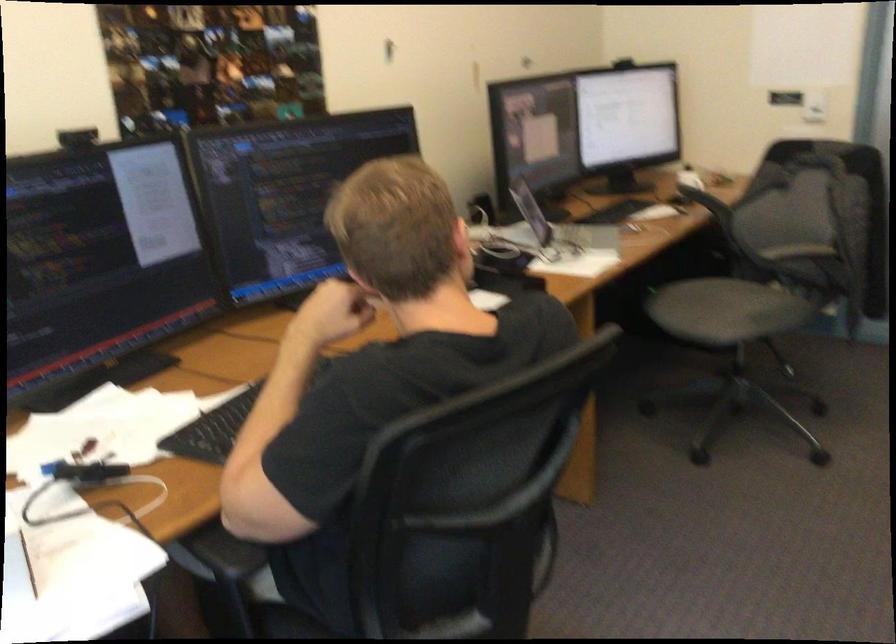
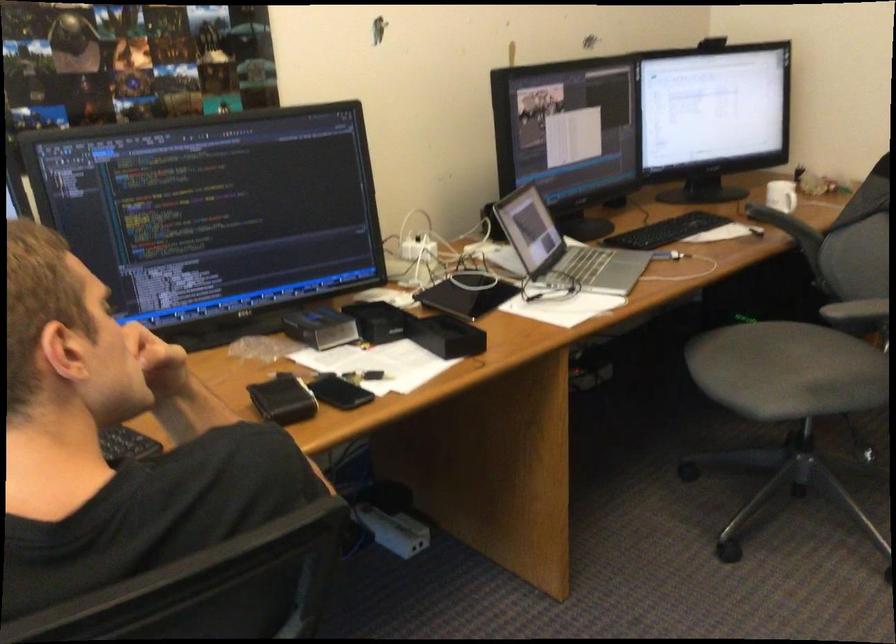
Question: How did the camera likely rotate?

Choices:
 (A) Left
 (B) Right
 (C) Up
 (D) Down

Answer: (A)